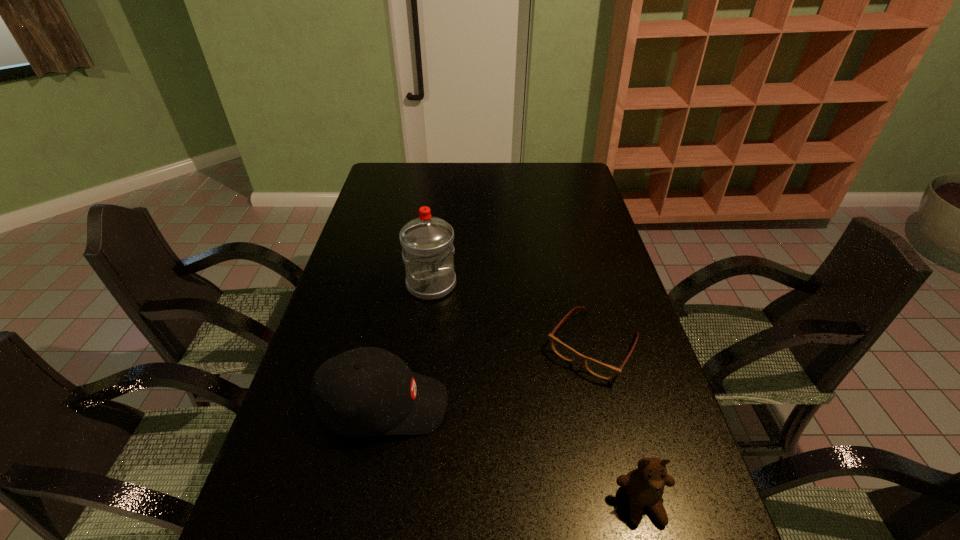
The image size is (960, 540). Find the location of `vacant space at the far left corner`. vacant space at the far left corner is located at coordinates (403, 170).

In the image, there is a desktop. Identify the location of blank space at the near left corner. The width and height of the screenshot is (960, 540). (326, 534).

Find the location of `vacant space at the far right corner of the desktop`. vacant space at the far right corner of the desktop is located at coordinates point(566,167).

Image resolution: width=960 pixels, height=540 pixels. I want to click on blank region between the farthest object and the spectacles, so click(513, 315).

Locate an element on the screen. The height and width of the screenshot is (540, 960). free spot between the teddy bear and the tallest object is located at coordinates (537, 394).

What are the coordinates of `vacant space that's between the baseball cap and the nearest object` in the screenshot? It's located at (514, 455).

I want to click on free spot between the baseball cap and the tallest object, so click(x=408, y=345).

Locate an element on the screen. vacant space in between the nearest object and the farthest object is located at coordinates (537, 394).

You are a GUI agent. You are given a task and a screenshot of the screen. Output one action in this format:
    pyautogui.click(x=<x>, y=<y>)
    Task: Click on the unoccupied area between the shortest object and the water bottle
    
    Given the screenshot: What is the action you would take?
    pyautogui.click(x=513, y=315)

The height and width of the screenshot is (540, 960). I want to click on vacant region between the spectacles and the tallest object, so click(x=513, y=315).